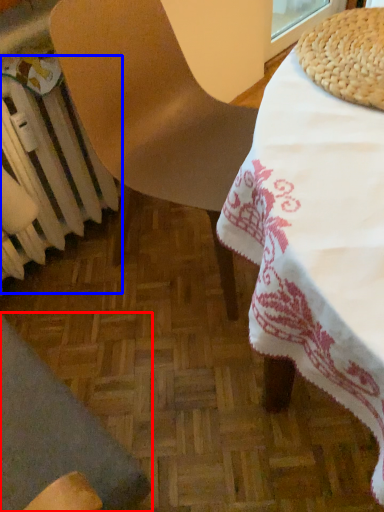
Question: Among these objects, which one is farthest to the camera, chair (highlighted by a red box) or radiator (highlighted by a blue box)?

Choices:
 (A) chair
 (B) radiator

Answer: (B)